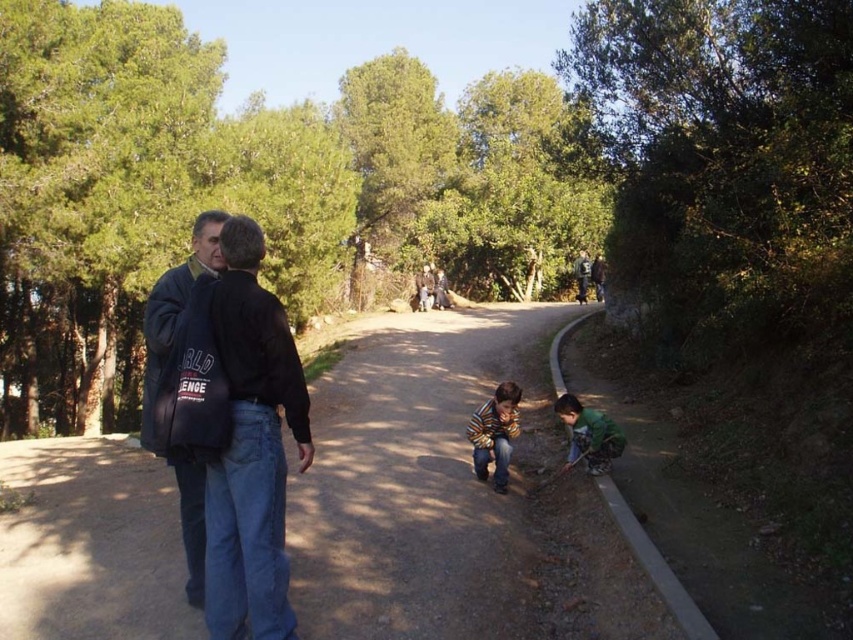
Is green matte jacket at lower right taller than dark blue jacket at center?

No.

The height and width of the screenshot is (640, 853). Describe the element at coordinates (589, 435) in the screenshot. I see `green matte jacket at lower right` at that location.

Does point (567, 410) come closer to viewer compared to point (589, 280)?

Yes, point (567, 410) is closer to viewer.

The width and height of the screenshot is (853, 640). What are the coordinates of `green matte jacket at lower right` in the screenshot? It's located at (589, 435).

Is black cotton jacket at left closer to the viewer compared to striped cotton shirt at center?

Yes, black cotton jacket at left is in front of striped cotton shirt at center.

Can you confirm if black cotton jacket at left is taller than striped cotton shirt at center?

Correct, black cotton jacket at left is much taller as striped cotton shirt at center.

Which is in front, point (286, 570) or point (505, 448)?

Point (286, 570) is in front.

The image size is (853, 640). Find the location of `black cotton jacket at left`. black cotton jacket at left is located at coordinates (251, 449).

Is point (175, 300) positioned before point (492, 472)?

Yes.

Image resolution: width=853 pixels, height=640 pixels. In order to click on dark blue jacket at left in this screenshot , I will do `click(175, 305)`.

Is point (190, 548) closer to camera compared to point (492, 392)?

Yes, it is in front of point (492, 392).

Locate an element on the screen. The width and height of the screenshot is (853, 640). dark blue jacket at left is located at coordinates (175, 305).